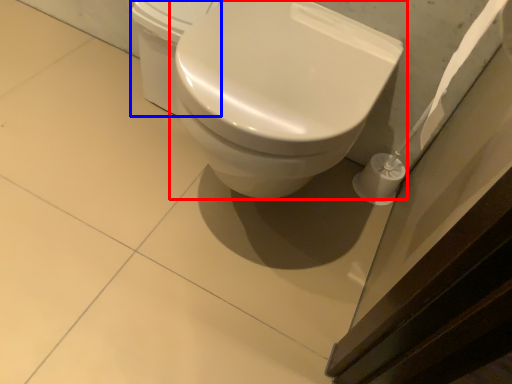
Question: Which of the following is the farthest to the observer, toilet (highlighted by a red box) or porcelain (highlighted by a blue box)?

Choices:
 (A) toilet
 (B) porcelain

Answer: (B)